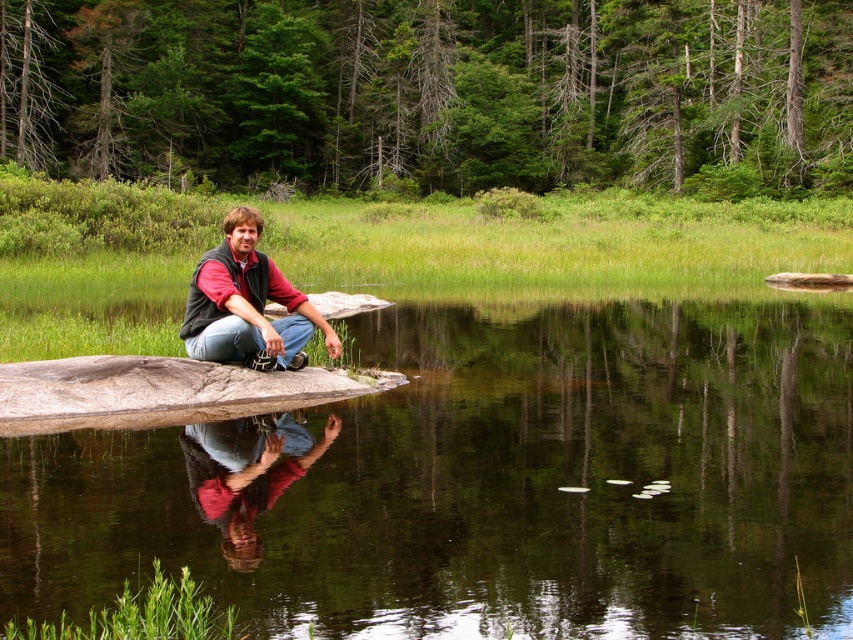
You are an artist planning to paint this scene. You want to ensure the transparent water at center and the matte black vest at center are proportionally accurate. Which object should you paint first to maintain the correct size relationship?

You should paint the transparent water at center first because it is bigger than the matte black vest at center, allowing you to establish the larger area before detailing the smaller object.

You are a photographer trying to capture the reflection of the man in the water. The transparent water at center and the matte black vest at center are both in your viewfinder. Which object is shorter in height?

The transparent water at center is not as tall as the matte black vest at center, so the transparent water at center is shorter in height.